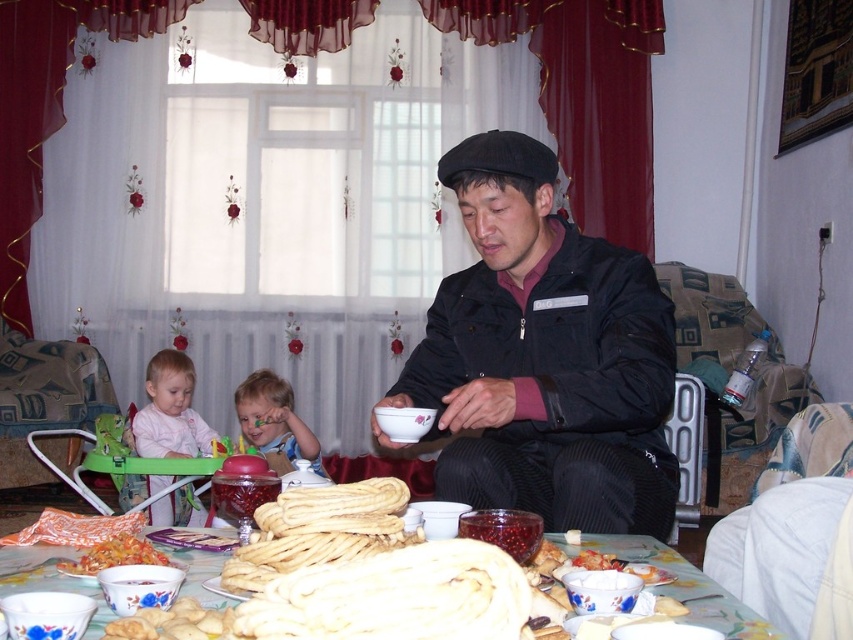
You are a guest at this table and want to grab the golden doughnut at center to give to the light pink fabric baby at left. Can you reach it without moving from your seat?

The golden doughnut at center is closer to the viewer than the light pink fabric baby at left, so yes, you can reach it without moving from your seat because it is nearer to you.

You are a chef who just placed the golden crispy breadsticks at center on the white ceramic table at lower center. Now you need to check if they are within the required 5 inches of the table edge. Can you confirm?

The golden crispy breadsticks at center and white ceramic table at lower center are 5.15 inches apart, which exceeds the required 5 inches, so they are not within the required distance.